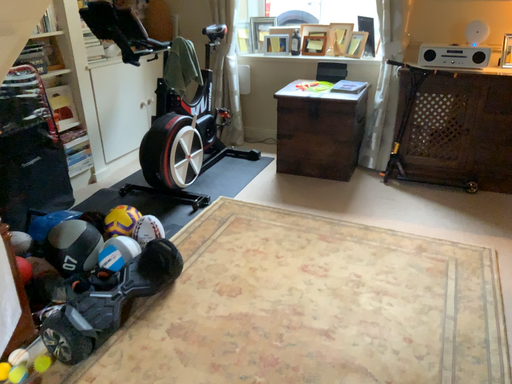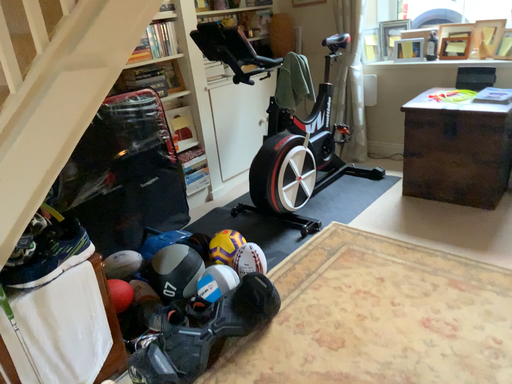
Question: How did the camera likely rotate when shooting the video?

Choices:
 (A) rotated right
 (B) rotated left

Answer: (B)